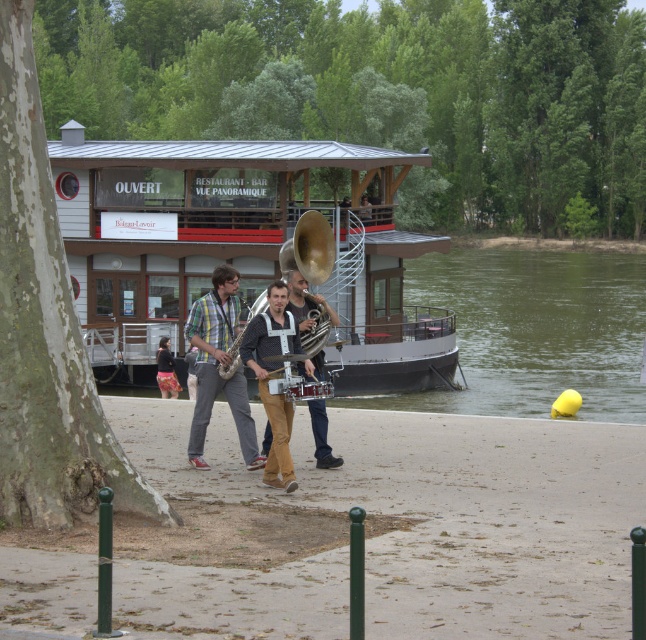
Question: Is floral skirt at center above shiny silver saxophone at center?

Choices:
 (A) yes
 (B) no

Answer: (B)

Question: Which object appears closest to the camera in this image?

Choices:
 (A) floral skirt at center
 (B) white wooden boat at center
 (C) matte black saxophone at center
 (D) shiny silver saxophone at center

Answer: (C)

Question: Can you confirm if plaid fabric shirt at center is positioned above shiny silver saxophone at center?

Choices:
 (A) no
 (B) yes

Answer: (A)

Question: Estimate the real-world distances between objects in this image. Which object is farther from the plaid fabric shirt at center?

Choices:
 (A) floral skirt at center
 (B) matte black saxophone at center
 (C) shiny silver saxophone at center

Answer: (A)

Question: Does white wooden boat at center come behind shiny silver saxophone at center?

Choices:
 (A) no
 (B) yes

Answer: (B)

Question: Among these objects, which one is farthest from the camera?

Choices:
 (A) shiny silver saxophone at center
 (B) plaid fabric shirt at center

Answer: (B)